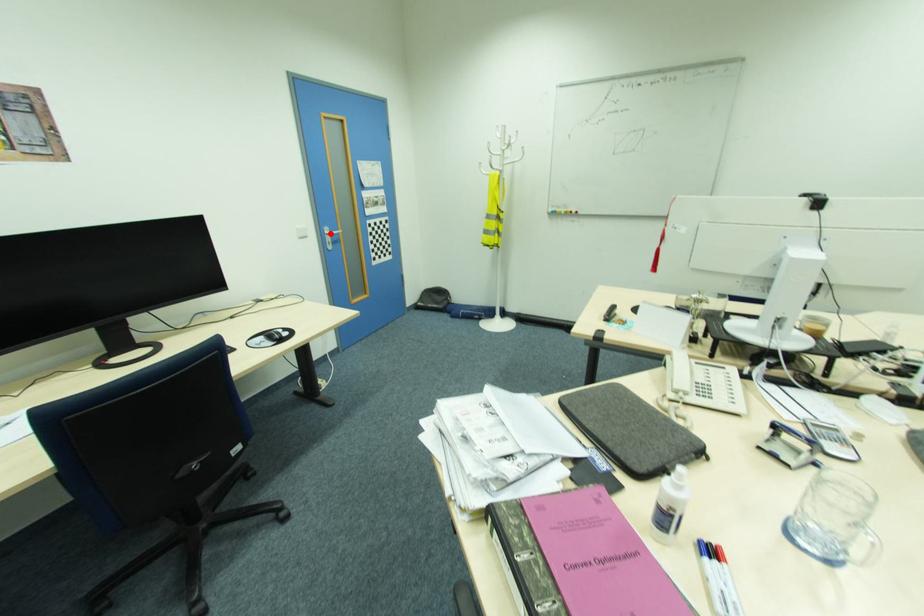
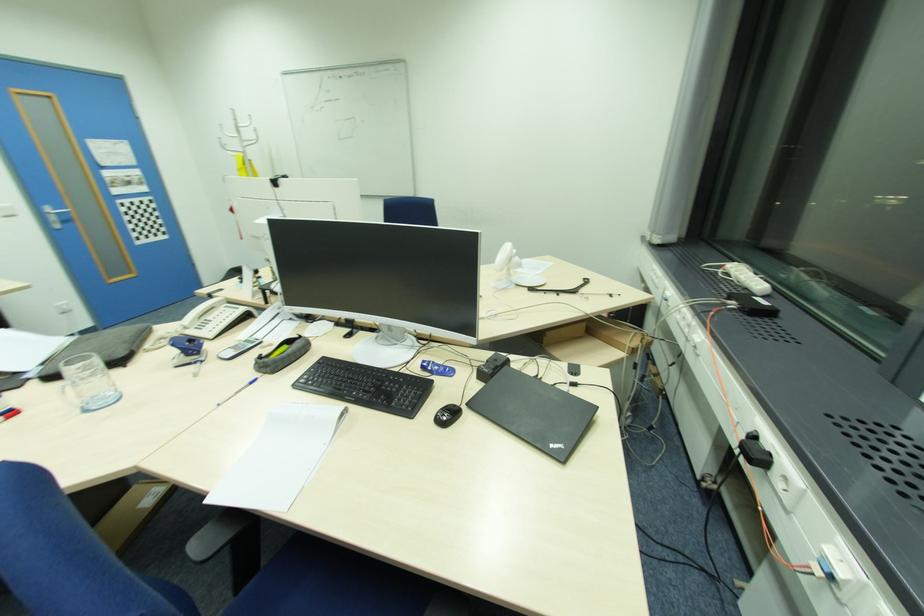
In the second image, find the point that corresponds to the highlighted location in the first image.

(54, 213)